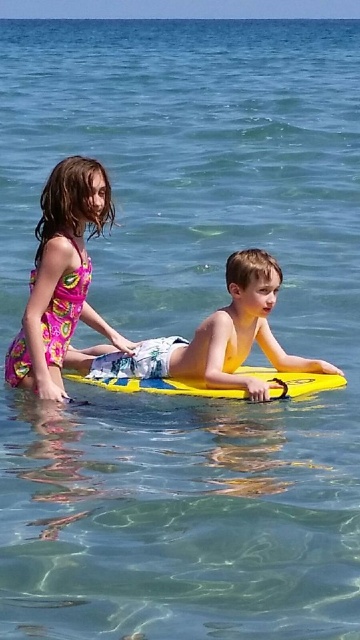
Does floral dress at left come behind yellow foam surfboard at center?

Yes, it is.

From the picture: Does floral dress at left appear over yellow foam surfboard at center?

Indeed, floral dress at left is positioned over yellow foam surfboard at center.

Find the location of a particular element. The image size is (360, 640). floral dress at left is located at coordinates (61, 280).

This screenshot has height=640, width=360. What are the coordinates of `floral dress at left` in the screenshot? It's located at (61, 280).

Does yellow foam board at center appear on the left side of yellow foam surfboard at center?

Correct, you'll find yellow foam board at center to the left of yellow foam surfboard at center.

Does yellow foam board at center come behind yellow foam surfboard at center?

No, yellow foam board at center is in front of yellow foam surfboard at center.

This screenshot has width=360, height=640. What do you see at coordinates (212, 346) in the screenshot?
I see `yellow foam board at center` at bounding box center [212, 346].

The width and height of the screenshot is (360, 640). Find the location of `yellow foam board at center`. yellow foam board at center is located at coordinates (212, 346).

Does floral dress at left have a greater width compared to yellow foam board at center?

No, floral dress at left is not wider than yellow foam board at center.

Who is higher up, floral dress at left or yellow foam board at center?

floral dress at left is higher up.

Between point (95, 189) and point (241, 252), which one is positioned in front?

Point (95, 189) is in front.

This screenshot has width=360, height=640. Identify the location of floral dress at left. (61, 280).